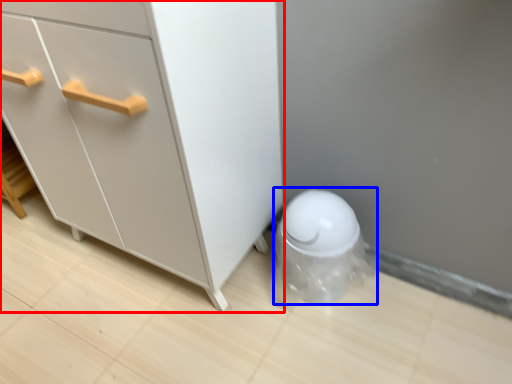
Question: Which object is further to the camera taking this photo, chest of drawers (highlighted by a red box) or porcelain (highlighted by a blue box)?

Choices:
 (A) chest of drawers
 (B) porcelain

Answer: (B)